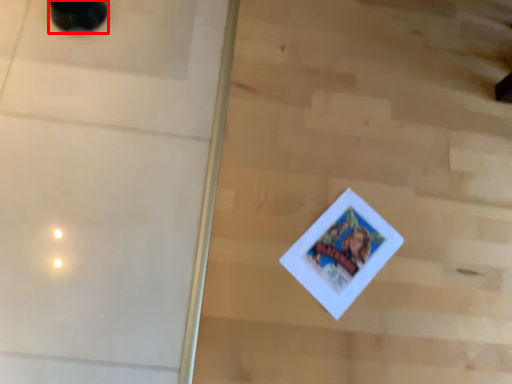
Question: From the image's perspective, where is footwear (annotated by the red box) located in relation to screen door in the image?

Choices:
 (A) above
 (B) below

Answer: (A)